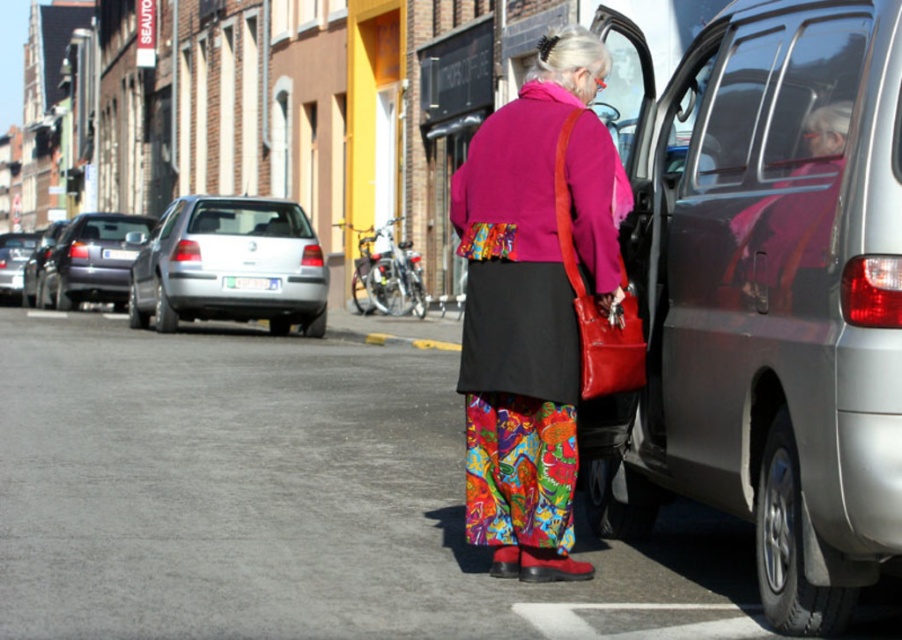
Question: From the image, what is the correct spatial relationship of metallic gray suv at right in relation to silver metallic car at left?

Choices:
 (A) left
 (B) right

Answer: (B)

Question: Estimate the real-world distances between objects in this image. Which object is closer to the silver metallic sedan at left?

Choices:
 (A) silver metallic car at left
 (B) metallic silver sedan at left

Answer: (B)

Question: Which point is closer to the camera?

Choices:
 (A) matte pink coat at center
 (B) silver metallic car at left
 (C) metallic gray suv at right

Answer: (C)

Question: Does metallic silver sedan at left have a greater width compared to silver metallic sedan at left?

Choices:
 (A) no
 (B) yes

Answer: (A)

Question: Which point is closer to the camera taking this photo?

Choices:
 (A) (11, 250)
 (B) (896, 134)
 (C) (94, 227)
 (D) (491, 138)

Answer: (B)

Question: Is silver metallic car at left wider than silver metallic sedan at left?

Choices:
 (A) no
 (B) yes

Answer: (A)